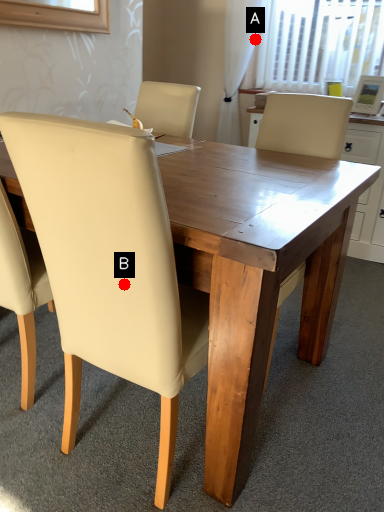
Question: Two points are circled on the image, labeled by A and B beside each circle. Among these points, which one is nearest to the camera?

Choices:
 (A) A is closer
 (B) B is closer

Answer: (B)